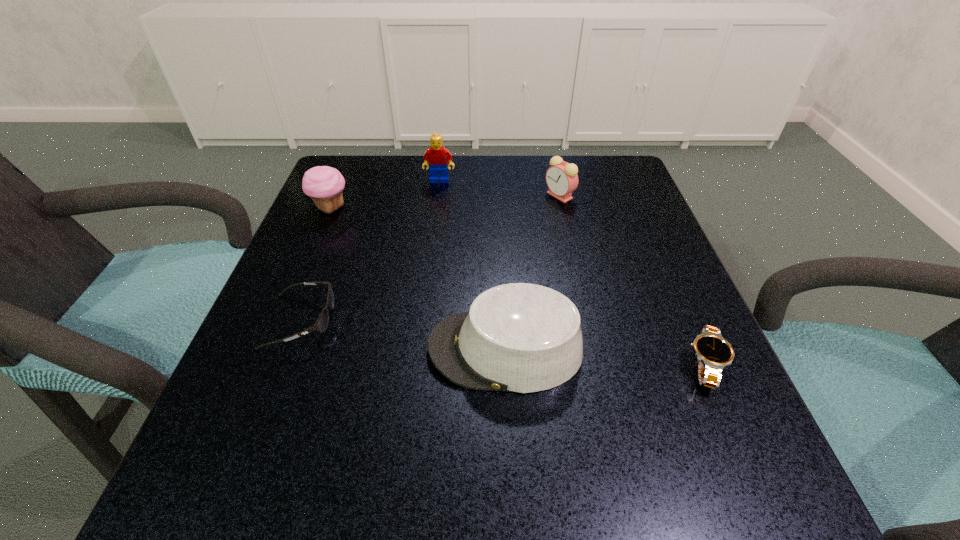
Identify the location of free point between the sunglasses and the alarm clock. The width and height of the screenshot is (960, 540). (430, 259).

Where is `free space between the alarm clock and the Lego`? This screenshot has width=960, height=540. free space between the alarm clock and the Lego is located at coordinates (499, 188).

Find the location of a particular element. The width and height of the screenshot is (960, 540). free spot between the hat and the shortest object is located at coordinates (605, 357).

Image resolution: width=960 pixels, height=540 pixels. Find the location of `free space between the cupcake and the Lego`. free space between the cupcake and the Lego is located at coordinates (385, 194).

Where is `object that ranks as the second closest to the hat`? This screenshot has width=960, height=540. object that ranks as the second closest to the hat is located at coordinates (321, 324).

Locate an element on the screen. This screenshot has height=540, width=960. the closest object to the sunglasses is located at coordinates (519, 337).

The image size is (960, 540). I want to click on blank area in the image that satisfies the following two spatial constraints: 1. on the front-facing side of the fifth tallest object; 2. on the right side of the watch, so click(284, 364).

Find the location of `free space that satisfies the following two spatial constraints: 1. on the front-facing side of the rightmost object; 2. on the left side of the farthest object`. free space that satisfies the following two spatial constraints: 1. on the front-facing side of the rightmost object; 2. on the left side of the farthest object is located at coordinates (417, 364).

Find the location of a particular element. Image resolution: width=960 pixels, height=540 pixels. vacant region that satisfies the following two spatial constraints: 1. on the front-facing side of the farthest object; 2. on the front-facing side of the fifth tallest object is located at coordinates (422, 321).

Locate an element on the screen. free spot that satisfies the following two spatial constraints: 1. on the front-facing side of the sunglasses; 2. on the right side of the watch is located at coordinates (284, 364).